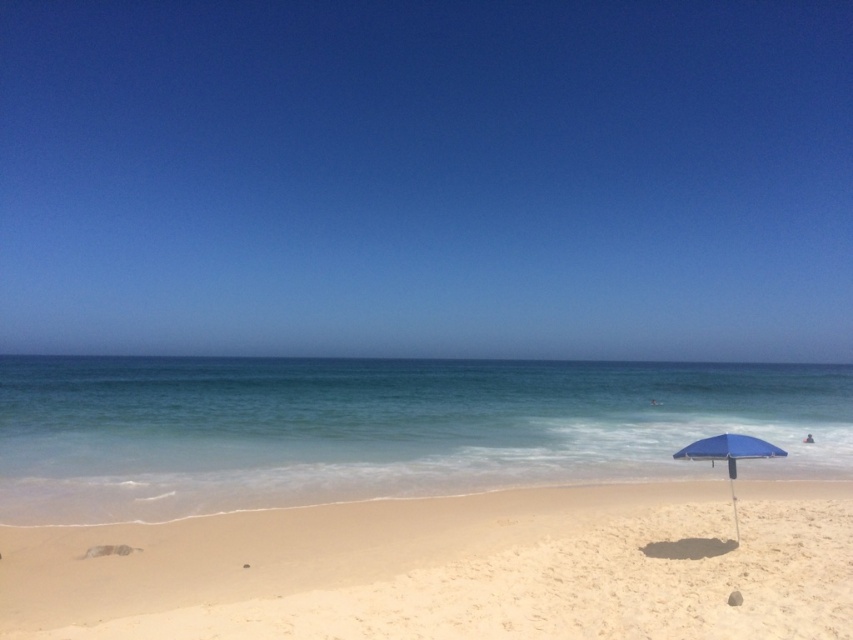
Question: Which of the following is the farthest from the observer?

Choices:
 (A) clear blue water at center
 (B) blue fabric umbrella at lower right

Answer: (A)

Question: Among these objects, which one is nearest to the camera?

Choices:
 (A) clear blue water at center
 (B) light beige sand at lower center

Answer: (B)

Question: Does light beige sand at lower center appear over blue fabric umbrella at lower right?

Choices:
 (A) yes
 (B) no

Answer: (B)

Question: Which object is closer to the camera taking this photo?

Choices:
 (A) clear blue water at center
 (B) blue fabric umbrella at lower right

Answer: (B)

Question: Does light beige sand at lower center appear on the right side of clear blue water at center?

Choices:
 (A) no
 (B) yes

Answer: (A)

Question: Observing the image, what is the correct spatial positioning of light beige sand at lower center in reference to clear blue water at center?

Choices:
 (A) left
 (B) right

Answer: (A)